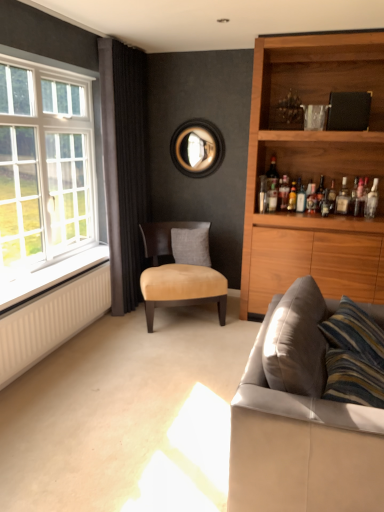
Question: In terms of size, does white radiator at lower left appear bigger or smaller than clear glass bottle at upper right, which is counted as the first bottle, starting from the left?

Choices:
 (A) big
 (B) small

Answer: (A)

Question: Considering the positions of white radiator at lower left and clear glass bottle at upper right, which is counted as the first bottle, starting from the left, in the image, is white radiator at lower left taller or shorter than clear glass bottle at upper right, which is counted as the first bottle, starting from the left,?

Choices:
 (A) tall
 (B) short

Answer: (B)

Question: Estimate the real-world distances between objects in this image. Which object is farther from the leather couch at lower right?

Choices:
 (A) white textured radiator at lower left
 (B) matte glass bottle at upper right, which ranks as the third bottle in left-to-right order
 (C) white radiator at lower left
 (D) clear glass bottle at upper right, placed as the sixth bottle when sorted from left to right
 (E) white glass window at left

Answer: (D)

Question: Which is nearer to the matte glass bottle at upper right, which ranks as the third bottle in left-to-right order?

Choices:
 (A) white textured radiator at lower left
 (B) wooden circular frame at center
 (C) translucent glass bottle at upper right, the 5th bottle positioned from the right
 (D) clear glass bottle at upper right, placed as the sixth bottle when sorted from left to right
 (E) white glass window at left

Answer: (C)